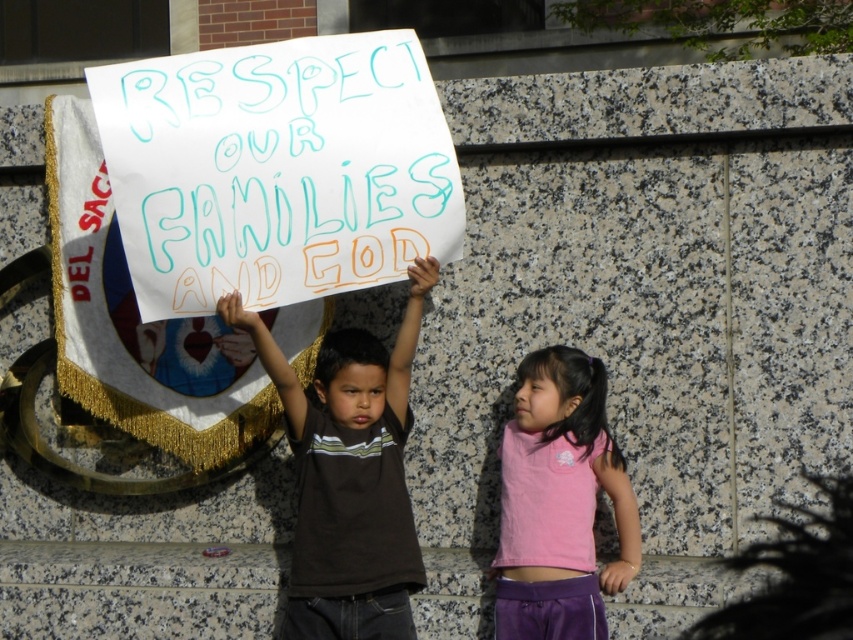
Question: Which object is closer to the camera taking this photo?

Choices:
 (A) white paper sign at center
 (B) pink fabric shirt at center

Answer: (A)

Question: Which of these objects is positioned farthest from the dark brown t-shirt at center?

Choices:
 (A) white paper sign at center
 (B) pink fabric shirt at center

Answer: (B)

Question: Can you confirm if dark brown t-shirt at center is bigger than pink fabric shirt at center?

Choices:
 (A) yes
 (B) no

Answer: (A)

Question: From the image, what is the correct spatial relationship of dark brown t-shirt at center in relation to pink fabric shirt at center?

Choices:
 (A) above
 (B) below

Answer: (A)

Question: Which of these objects is positioned closest to the white paper sign at center?

Choices:
 (A) pink fabric shirt at center
 (B) dark brown t-shirt at center

Answer: (B)

Question: Is dark brown t-shirt at center behind pink fabric shirt at center?

Choices:
 (A) yes
 (B) no

Answer: (B)